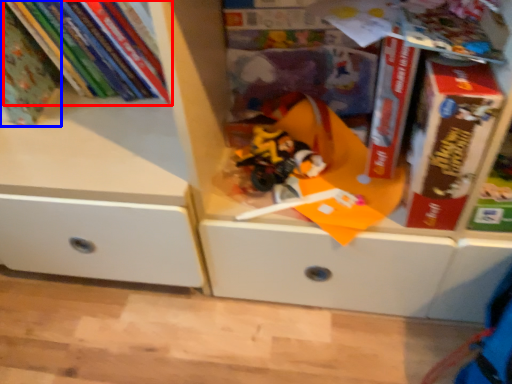
Question: Which point is closer to the camera, book (highlighted by a red box) or book (highlighted by a blue box)?

Choices:
 (A) book
 (B) book

Answer: (B)